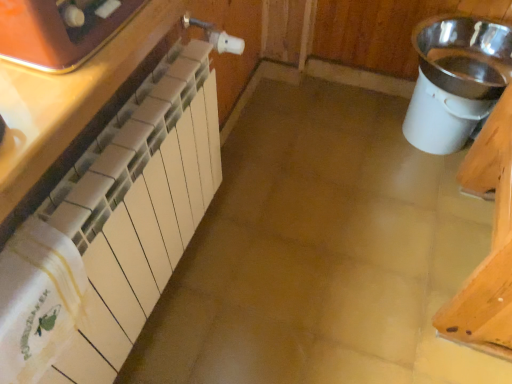
Question: Is point (147, 19) positioned closer to the camera than point (77, 13)?

Choices:
 (A) closer
 (B) farther

Answer: (B)

Question: From a real-world perspective, is matte white radiator at left, the 1th cabinetry from the back, positioned above or below matte orange toaster at upper left?

Choices:
 (A) below
 (B) above

Answer: (A)

Question: Which object is the closest to the silver metallic sink at right?

Choices:
 (A) matte orange toaster at upper left
 (B) white glossy radiator at left, the 2th cabinetry in the back-to-front sequence
 (C) matte white radiator at left, the second cabinetry positioned from the front

Answer: (C)

Question: Which of these objects is positioned closest to the white glossy radiator at left, the 2th cabinetry in the back-to-front sequence?

Choices:
 (A) matte orange toaster at upper left
 (B) matte white radiator at left, the 1th cabinetry from the back
 (C) silver metallic sink at right

Answer: (A)